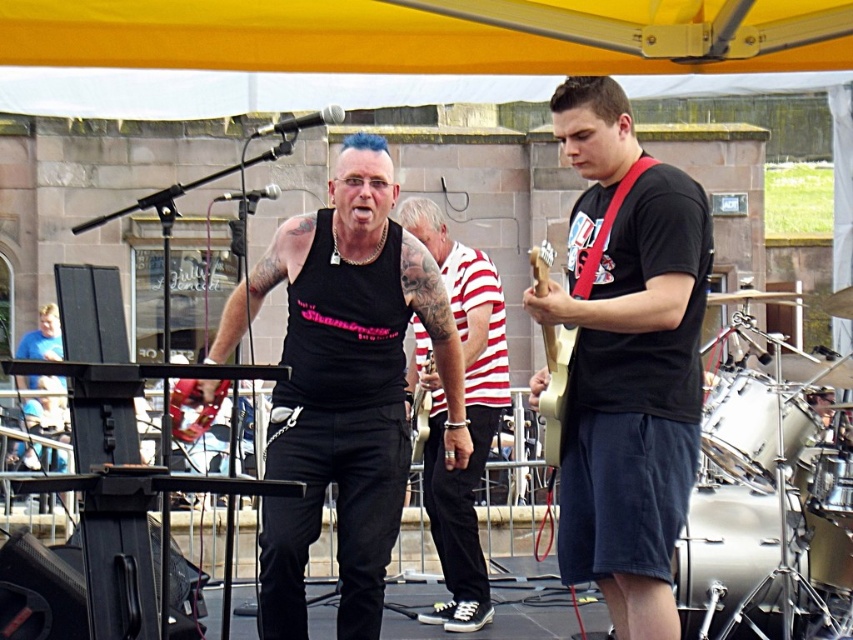
Is brushed metal drum at lower right wider than matte black tank top at center?

Yes, brushed metal drum at lower right is wider than matte black tank top at center.

Which of these two, brushed metal drum at lower right or matte black tank top at center, stands taller?

brushed metal drum at lower right

Find the location of a particular element. brushed metal drum at lower right is located at coordinates (724, 545).

Between black matte tank top at center and white drum at right, which one has more height?

With more height is black matte tank top at center.

Measure the distance between black matte tank top at center and white drum at right.

black matte tank top at center and white drum at right are 7.65 meters apart.

The height and width of the screenshot is (640, 853). I want to click on black matte tank top at center, so click(x=341, y=385).

You are a GUI agent. You are given a task and a screenshot of the screen. Output one action in this format:
    pyautogui.click(x=<x>, y=<y>)
    Task: Click on the black matte tank top at center
    The width and height of the screenshot is (853, 640).
    Given the screenshot: What is the action you would take?
    (341, 385)

Is gold metallic guitar at center to the left of matte black tank top at center from the viewer's perspective?

No, gold metallic guitar at center is not to the left of matte black tank top at center.

Is gold metallic guitar at center to the right of matte black tank top at center from the viewer's perspective?

Correct, you'll find gold metallic guitar at center to the right of matte black tank top at center.

Image resolution: width=853 pixels, height=640 pixels. What do you see at coordinates (555, 388) in the screenshot?
I see `gold metallic guitar at center` at bounding box center [555, 388].

Identify the location of gold metallic guitar at center. (555, 388).